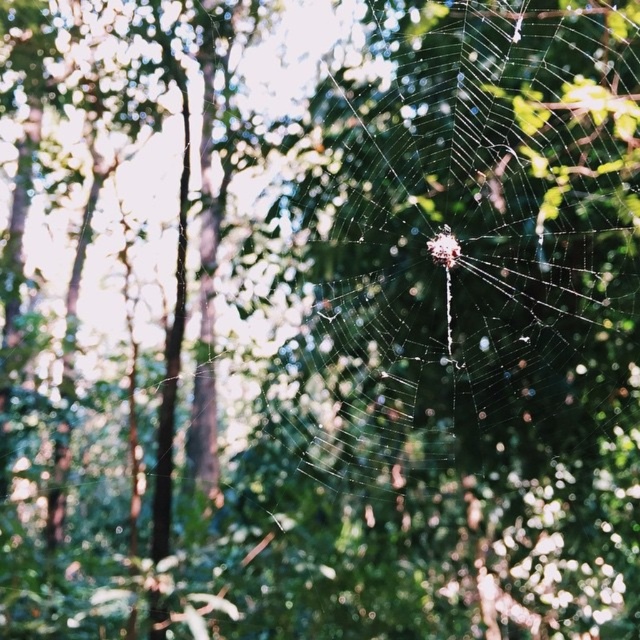
Which is more to the left, transparent silk spider web at center or translucent silk spider at center?

transparent silk spider web at center is more to the left.

Is transparent silk spider web at center smaller than translucent silk spider at center?

No, transparent silk spider web at center is not smaller than translucent silk spider at center.

Who is more distant from viewer, (362, 104) or (442, 237)?

Positioned behind is point (362, 104).

The width and height of the screenshot is (640, 640). I want to click on transparent silk spider web at center, so click(x=465, y=243).